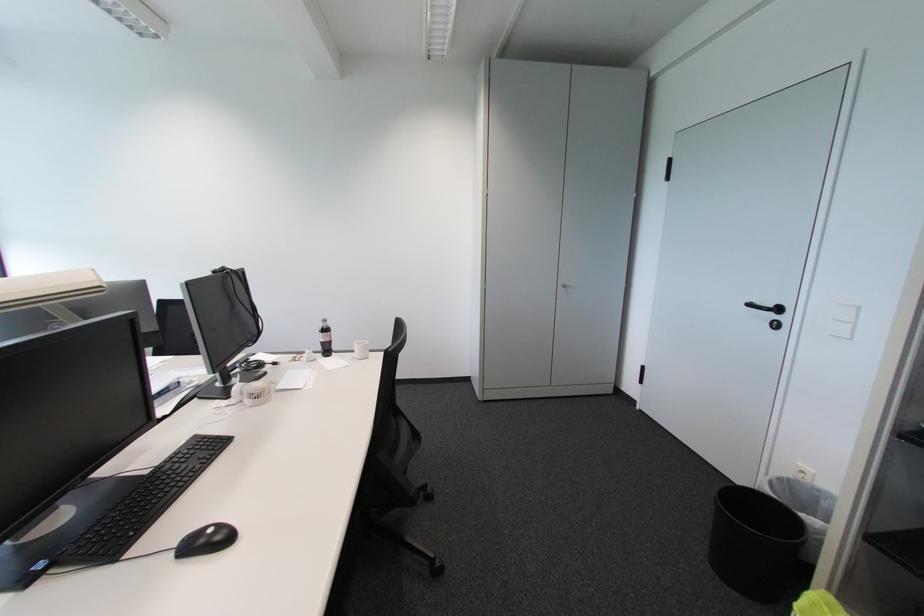
At what (x,y) coordinates should I click in order to perform the action: click on white mug. Please return your answer as a coordinate pair (x, y). Image resolution: width=924 pixels, height=616 pixels. Looking at the image, I should click on (360, 349).